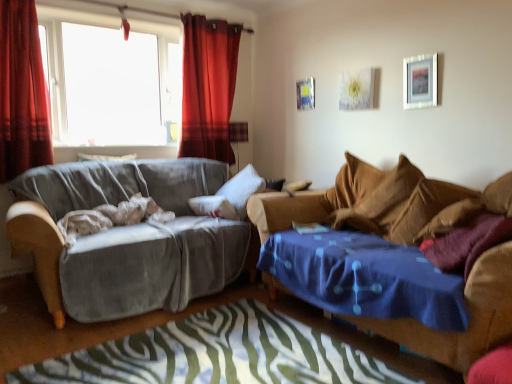
Question: Does velvet gray couch at left, marked as the 1th studio couch in a left-to-right arrangement, appear on the left side of metallic silver picture frame at upper center, which is the second picture frame in front-to-back order?

Choices:
 (A) no
 (B) yes

Answer: (B)

Question: Does velvet gray couch at left, marked as the 1th studio couch in a left-to-right arrangement, have a greater width compared to metallic silver picture frame at upper center, which is the 2th picture frame in right-to-left order?

Choices:
 (A) yes
 (B) no

Answer: (A)

Question: Is velvet gray couch at left, marked as the second studio couch in a right-to-left arrangement, at the right side of metallic silver picture frame at upper center, which is the second picture frame in front-to-back order?

Choices:
 (A) no
 (B) yes

Answer: (A)

Question: From the image's perspective, is velvet gray couch at left, marked as the second studio couch in a right-to-left arrangement, located beneath metallic silver picture frame at upper center, which is the second picture frame in front-to-back order?

Choices:
 (A) no
 (B) yes

Answer: (B)

Question: From a real-world perspective, is velvet gray couch at left, marked as the 1th studio couch in a left-to-right arrangement, physically above metallic silver picture frame at upper center, which is the 2th picture frame in right-to-left order?

Choices:
 (A) yes
 (B) no

Answer: (B)

Question: Is velvet gray couch at left, marked as the 1th studio couch in a left-to-right arrangement, far away from metallic silver picture frame at upper center, the 1th picture frame in the back-to-front sequence?

Choices:
 (A) yes
 (B) no

Answer: (A)

Question: Is the position of velvet red curtain at upper left, the 1th curtain when ordered from right to left, more distant than that of velvet gray couch at left, marked as the 1th studio couch in a left-to-right arrangement?

Choices:
 (A) no
 (B) yes

Answer: (B)

Question: From the image's perspective, is velvet red curtain at upper left, the 2th curtain from the left, beneath velvet gray couch at left, marked as the 1th studio couch in a left-to-right arrangement?

Choices:
 (A) no
 (B) yes

Answer: (A)

Question: Considering the relative positions of velvet red curtain at upper left, which ranks as the second curtain in front-to-back order, and velvet gray couch at left, marked as the 1th studio couch in a left-to-right arrangement, in the image provided, is velvet red curtain at upper left, which ranks as the second curtain in front-to-back order, to the left of velvet gray couch at left, marked as the 1th studio couch in a left-to-right arrangement, from the viewer's perspective?

Choices:
 (A) yes
 (B) no

Answer: (B)

Question: Would you say velvet gray couch at left, marked as the 1th studio couch in a left-to-right arrangement, is part of velvet red curtain at upper left, the 2th curtain from the left,'s contents?

Choices:
 (A) yes
 (B) no

Answer: (B)

Question: Can you confirm if velvet red curtain at upper left, which ranks as the second curtain in front-to-back order, is shorter than velvet gray couch at left, marked as the second studio couch in a right-to-left arrangement?

Choices:
 (A) yes
 (B) no

Answer: (B)

Question: Is velvet red curtain at upper left, the 1th curtain when ordered from right to left, at the right side of velvet gray couch at left, marked as the second studio couch in a right-to-left arrangement?

Choices:
 (A) no
 (B) yes

Answer: (B)

Question: From a real-world perspective, is velvet red curtain at upper left, which ranks as the second curtain in front-to-back order, located higher than metallic silver picture frame at upper center, placed as the 1th picture frame when sorted from left to right?

Choices:
 (A) no
 (B) yes

Answer: (B)